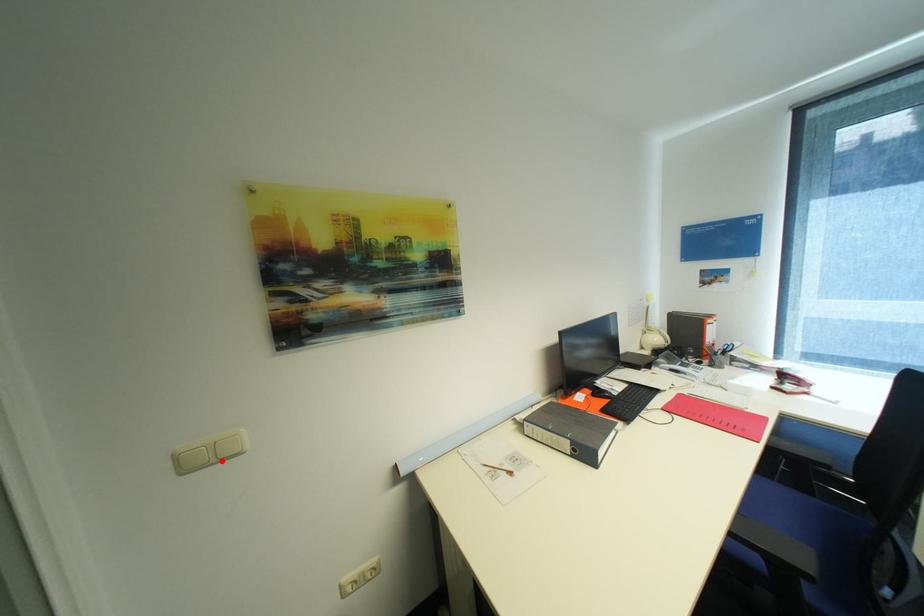
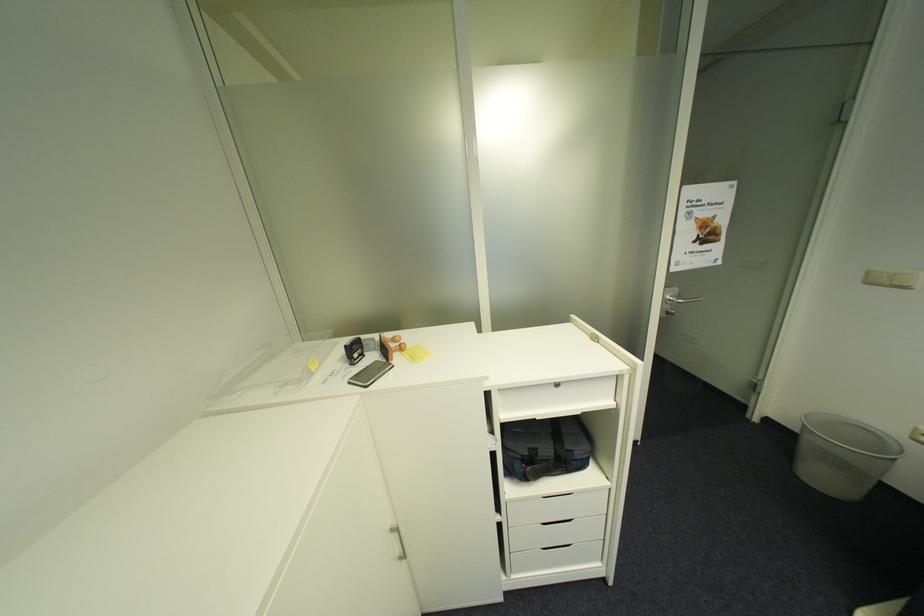
Question: I am providing you with two images of the same scene from different viewpoints. In image1, a red point is highlighted. Considering the same 3D point in image2, which of the following is correct?

Choices:
 (A) It is closer
 (B) It is farther

Answer: (B)